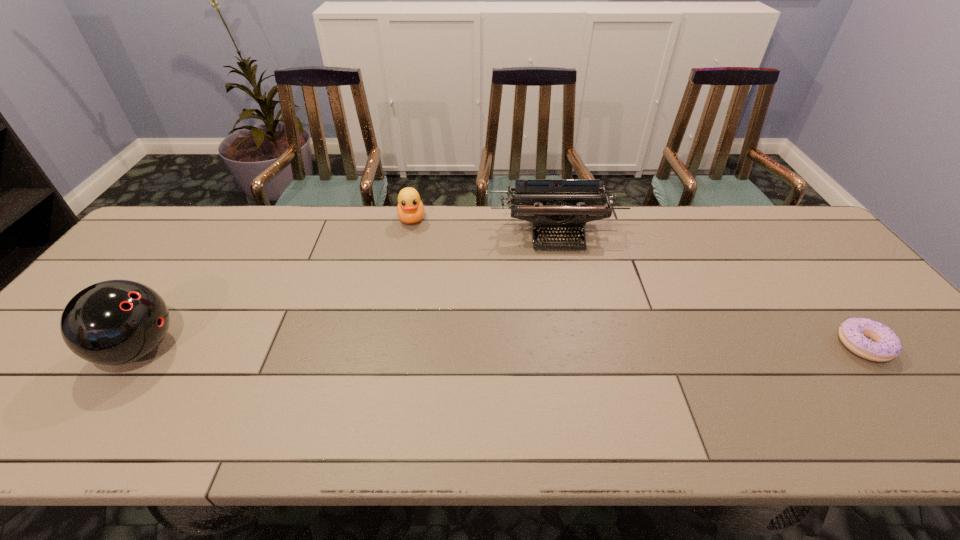
Find the location of a particular element. The width and height of the screenshot is (960, 540). the leftmost object is located at coordinates (114, 322).

The height and width of the screenshot is (540, 960). I want to click on bowling ball, so click(114, 322).

Locate an element on the screen. The height and width of the screenshot is (540, 960). the shortest object is located at coordinates (869, 339).

Where is `doughnut`? This screenshot has height=540, width=960. doughnut is located at coordinates (869, 339).

Where is `duckling`? This screenshot has width=960, height=540. duckling is located at coordinates (410, 209).

The height and width of the screenshot is (540, 960). Identify the location of the third object from right to left. (410, 209).

In order to click on the third shortest object in this screenshot , I will do tap(551, 204).

Image resolution: width=960 pixels, height=540 pixels. Find the location of `typewriter`. typewriter is located at coordinates (551, 204).

This screenshot has width=960, height=540. I want to click on vacant space situated on the surface of the tallest object near the finger holes, so click(242, 349).

The image size is (960, 540). What are the coordinates of `vacant region located on the left of the shortest object` in the screenshot? It's located at (777, 345).